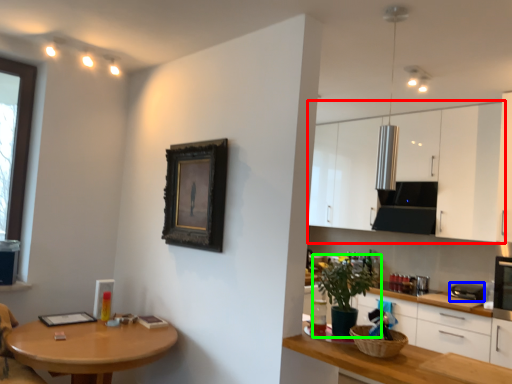
Question: Which is nearer to the cabinetry (highlighted by a red box)? appliance (highlighted by a blue box) or houseplant (highlighted by a green box).

Choices:
 (A) appliance
 (B) houseplant

Answer: (A)